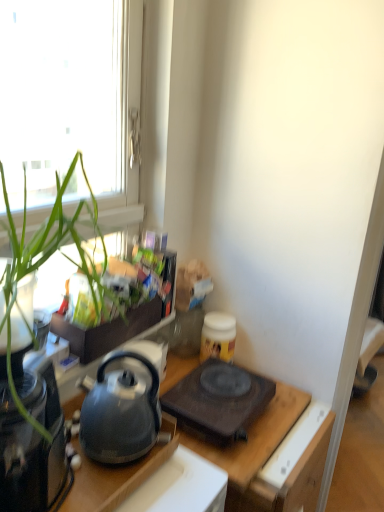
What do you see at coordinates (121, 412) in the screenshot?
I see `matte black kettle at left` at bounding box center [121, 412].

The image size is (384, 512). What do you see at coordinates (31, 445) in the screenshot?
I see `black glass coffee maker at left` at bounding box center [31, 445].

Describe the element at coordinates (218, 401) in the screenshot. The image size is (384, 512). I see `black matte gas stove at center` at that location.

Where is `matte black kettle at left`? This screenshot has height=512, width=384. matte black kettle at left is located at coordinates (121, 412).

Can you confirm if black matte gas stove at center is shorter than matte black kettle at left?

Correct, black matte gas stove at center is not as tall as matte black kettle at left.

Where is `gas stove beneath the matte black kettle at left (from a real-world perspective)`? Image resolution: width=384 pixels, height=512 pixels. gas stove beneath the matte black kettle at left (from a real-world perspective) is located at coordinates (218, 401).

In terms of width, does black matte gas stove at center look wider or thinner when compared to matte black kettle at left?

Considering their sizes, black matte gas stove at center looks broader than matte black kettle at left.

Is black matte gas stove at center to the left of matte black kettle at left from the viewer's perspective?

In fact, black matte gas stove at center is to the right of matte black kettle at left.

Between point (24, 264) and point (201, 394), which one is positioned in front?

The point (24, 264) is closer to the camera.

Is green leafy plant at left at the right side of black matte gas stove at center?

Incorrect, green leafy plant at left is not on the right side of black matte gas stove at center.

From the image's perspective, is green leafy plant at left located above or below black matte gas stove at center?

From the image's perspective, green leafy plant at left appears above black matte gas stove at center.

Between matte black kettle at left and green leafy plant at left, which one has less height?

Standing shorter between the two is matte black kettle at left.

Does matte black kettle at left have a greater width compared to green leafy plant at left?

No.

Considering their positions, is matte black kettle at left located in front of or behind green leafy plant at left?

In the image, matte black kettle at left appears behind green leafy plant at left.

Find the location of a particular element. The height and width of the screenshot is (512, 384). window located behind the black glass coffee maker at left is located at coordinates (70, 102).

From a real-world perspective, relative to transparent glass window at upper left, is black glass coffee maker at left vertically above or below?

In terms of real-world spatial position, black glass coffee maker at left is below transparent glass window at upper left.

Looking at this image, is the position of black glass coffee maker at left more distant than that of transparent glass window at upper left?

No, black glass coffee maker at left is closer to the viewer.

Which object is positioned more to the left, black glass coffee maker at left or transparent glass window at upper left?

black glass coffee maker at left is more to the left.

Between point (108, 437) and point (87, 510), which one is positioned behind?

The point (108, 437) is more distant.

In the scene shown: Is matte black kettle at left far away from matte black kettle at center?

No, matte black kettle at left is not far from matte black kettle at center.

Considering the sizes of matte black kettle at left and matte black kettle at center in the image, is matte black kettle at left taller or shorter than matte black kettle at center?

In the image, matte black kettle at left appears to be shorter than matte black kettle at center.

The width and height of the screenshot is (384, 512). What are the coordinates of `kettle that appears on the left of matte black kettle at center` in the screenshot? It's located at (121, 412).

Considering the sizes of black glass coffee maker at left and matte black kettle at left in the image, is black glass coffee maker at left taller or shorter than matte black kettle at left?

In the image, black glass coffee maker at left appears to be taller than matte black kettle at left.

From the image's perspective, between black glass coffee maker at left and matte black kettle at left, which one is located above?

black glass coffee maker at left appears higher in the image.

From a real-world perspective, which is physically below, black glass coffee maker at left or matte black kettle at left?

matte black kettle at left, from a real-world perspective.

Based on their positions, is matte black kettle at center located to the left or right of black glass coffee maker at left?

Clearly, matte black kettle at center is on the right of black glass coffee maker at left in the image.

Is matte black kettle at center far from black glass coffee maker at left?

Actually, matte black kettle at center and black glass coffee maker at left are a little close together.

From a real-world perspective, is matte black kettle at center beneath black glass coffee maker at left?

Correct, in the physical world, matte black kettle at center is lower than black glass coffee maker at left.

Where is `gas stove to the right of matte black kettle at left`? The height and width of the screenshot is (512, 384). gas stove to the right of matte black kettle at left is located at coordinates (218, 401).

This screenshot has height=512, width=384. In the image, there is a black matte gas stove at center. In order to click on houseplant above it (from the image's perspective) in this screenshot , I will do `click(47, 259)`.

Which object lies nearer to the anchor point matte black kettle at left, black matte gas stove at center or green leafy plant at left?

Among the two, black matte gas stove at center is located nearer to matte black kettle at left.

Considering their positions, is matte black kettle at center positioned closer to black glass coffee maker at left than black matte gas stove at center?

matte black kettle at center is closer to black glass coffee maker at left.

Which object lies further to the anchor point transparent glass window at upper left, green leafy plant at left or matte black kettle at center?

matte black kettle at center lies further to transparent glass window at upper left than the other object.

When comparing their distances from transparent glass window at upper left, does matte black kettle at center or green leafy plant at left seem further?

matte black kettle at center lies further to transparent glass window at upper left than the other object.

Which object lies nearer to the anchor point matte black kettle at center, black matte gas stove at center or green leafy plant at left?

black matte gas stove at center is closer to matte black kettle at center.

Looking at the image, which one is located closer to matte black kettle at center, green leafy plant at left or black matte gas stove at center?

black matte gas stove at center lies closer to matte black kettle at center than the other object.

From the image, which object appears to be farther from matte black kettle at left, black glass coffee maker at left or transparent glass window at upper left?

transparent glass window at upper left is positioned further to the anchor matte black kettle at left.

Looking at the image, which one is located further to black matte gas stove at center, matte black kettle at left or green leafy plant at left?

Based on the image, green leafy plant at left appears to be further to black matte gas stove at center.

This screenshot has height=512, width=384. Identify the location of kettle between transparent glass window at upper left and black matte gas stove at center vertically. (121, 412).

Where is `kettle located between black glass coffee maker at left and black matte gas stove at center in the left-right direction`? kettle located between black glass coffee maker at left and black matte gas stove at center in the left-right direction is located at coordinates (121, 412).

Locate an element on the screen. The width and height of the screenshot is (384, 512). kettle between black glass coffee maker at left and matte black kettle at center vertically is located at coordinates (121, 412).

The width and height of the screenshot is (384, 512). In order to click on houseplant between transparent glass window at upper left and matte black kettle at left in the vertical direction in this screenshot , I will do `click(47, 259)`.